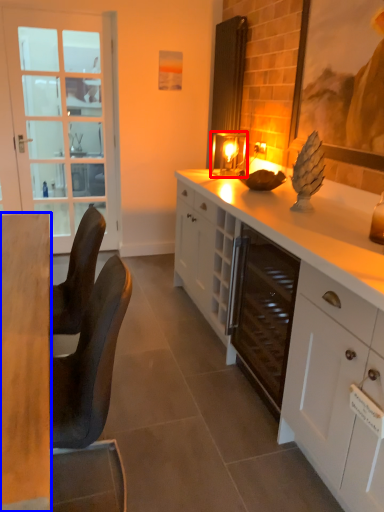
Question: Which of the following is the farthest to the observer, candle holder (highlighted by a red box) or desk (highlighted by a blue box)?

Choices:
 (A) candle holder
 (B) desk

Answer: (A)